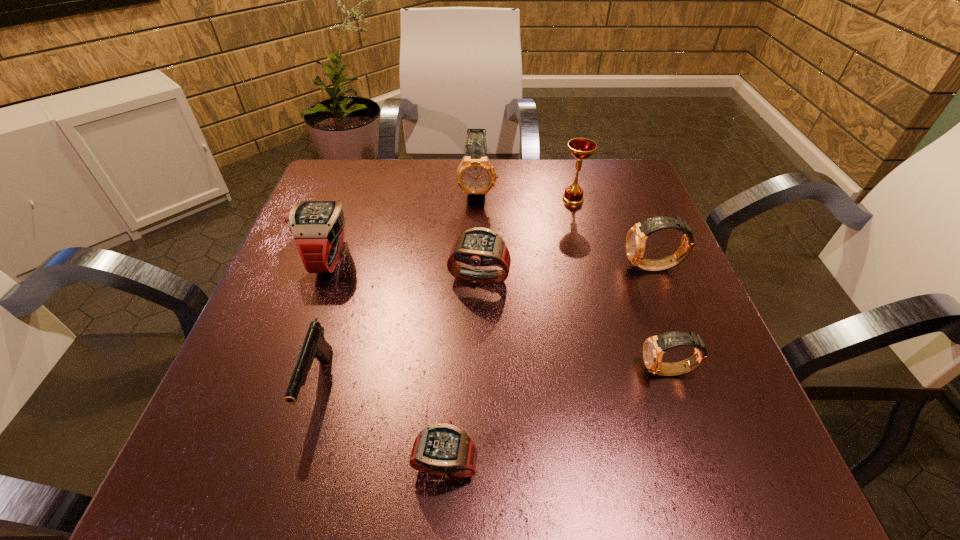
Find the location of a particular element. the nearest object is located at coordinates (444, 449).

Locate an element on the screen. This screenshot has height=540, width=960. the nearest red watch is located at coordinates (444, 449).

Where is `vacant space located on the face of the farthest gold watch`? This screenshot has width=960, height=540. vacant space located on the face of the farthest gold watch is located at coordinates (477, 328).

Locate an element on the screen. This screenshot has width=960, height=540. free space located on the back of the third object from right to left is located at coordinates (566, 172).

Image resolution: width=960 pixels, height=540 pixels. I want to click on vacant position located 0.130m on the back of the leftmost red watch, so click(348, 201).

You are a GUI agent. You are given a task and a screenshot of the screen. Output one action in this format:
    pyautogui.click(x=<x>, y=<y>)
    Task: Click on the vacant space located on the face of the second farthest gold watch
    This screenshot has width=960, height=540.
    Given the screenshot: What is the action you would take?
    pyautogui.click(x=546, y=267)

At what (x,y) coordinates should I click in order to perform the action: click on vacant space located 0.270m on the face of the second farthest gold watch. Please return your answer as a coordinate pair (x, y). Looking at the image, I should click on (492, 267).

Where is `vacant space situated 0.160m on the face of the second farthest gold watch`? vacant space situated 0.160m on the face of the second farthest gold watch is located at coordinates (546, 267).

Image resolution: width=960 pixels, height=540 pixels. I want to click on free region located on the front of the second smallest red watch, so click(479, 347).

Image resolution: width=960 pixels, height=540 pixels. I want to click on vacant position located 0.240m on the face of the fifth farthest watch, so click(496, 372).